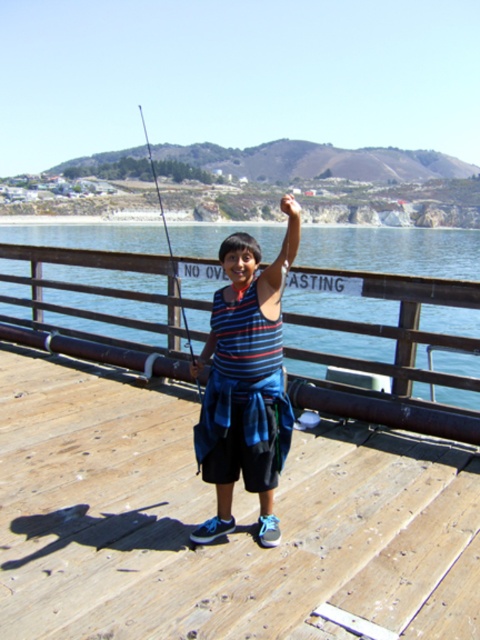
Between point (168, 545) and point (357, 348), which one is positioned behind?

The point (357, 348) is more distant.

Does wooden dock at center have a greater width compared to clear blue water at center?

In fact, wooden dock at center might be narrower than clear blue water at center.

Is point (146, 566) closer to viewer compared to point (392, 301)?

Yes, it is.

Locate an element on the screen. wooden dock at center is located at coordinates (211, 513).

Looking at this image, does clear blue water at center appear on the left side of matte black fishing rod at center?

No, clear blue water at center is not to the left of matte black fishing rod at center.

Does clear blue water at center have a greater width compared to matte black fishing rod at center?

Indeed, clear blue water at center has a greater width compared to matte black fishing rod at center.

The height and width of the screenshot is (640, 480). I want to click on clear blue water at center, so click(394, 250).

Does wooden dock at center have a greater width compared to matte black fishing rod at center?

In fact, wooden dock at center might be narrower than matte black fishing rod at center.

In the scene shown: Is wooden dock at center to the right of matte black fishing rod at center from the viewer's perspective?

Correct, you'll find wooden dock at center to the right of matte black fishing rod at center.

Is point (189, 496) farther from camera compared to point (179, 300)?

No.

At what (x,y) coordinates should I click in order to perform the action: click on wooden dock at center. Please return your answer as a coordinate pair (x, y). Looking at the image, I should click on (211, 513).